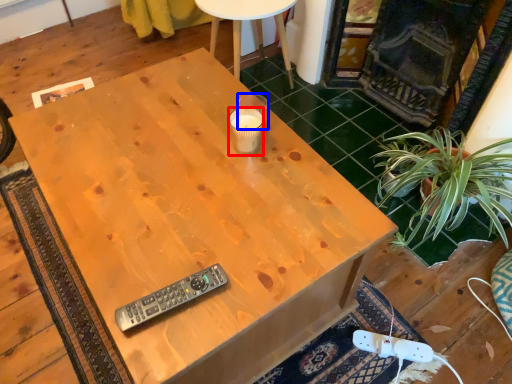
Question: Which of the following is the closest to the observer, coffee cup (highlighted by a red box) or coffee cup (highlighted by a blue box)?

Choices:
 (A) coffee cup
 (B) coffee cup

Answer: (A)